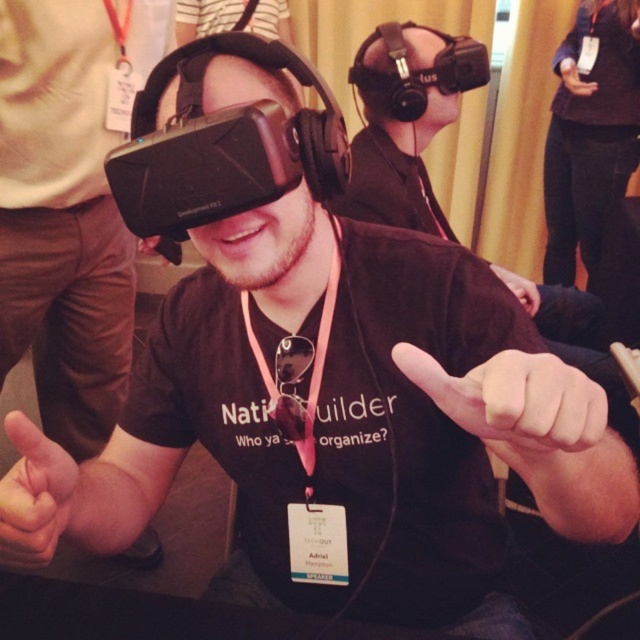
Question: Which point is closer to the camera taking this photo?

Choices:
 (A) (19, 509)
 (B) (394, 216)

Answer: (A)

Question: Is matte black vr headset at upper center above matte black hand at lower left?

Choices:
 (A) no
 (B) yes

Answer: (B)

Question: Among these objects, which one is nearest to the camera?

Choices:
 (A) pink fabric lanyard at center
 (B) white matte hand at center

Answer: (B)

Question: Is white matte hand at center thinner than matte black hand at upper right?

Choices:
 (A) yes
 (B) no

Answer: (B)

Question: Which point appears farthest from the camera in this image?

Choices:
 (A) (392, 72)
 (B) (259, 371)
 (C) (60, 497)

Answer: (A)

Question: Is white matte hand at center below matte black hand at upper right?

Choices:
 (A) yes
 (B) no

Answer: (A)